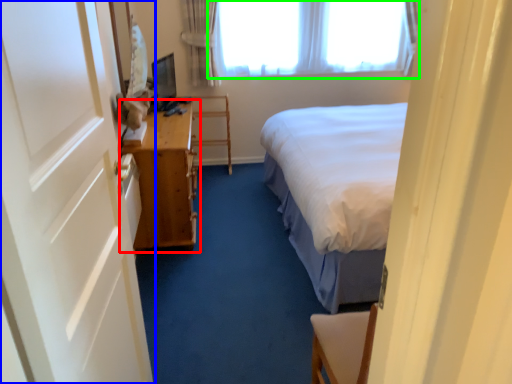
Question: Considering the real-world distances, which object is closest to table (highlighted by a red box)? door (highlighted by a blue box) or window (highlighted by a green box).

Choices:
 (A) door
 (B) window

Answer: (A)